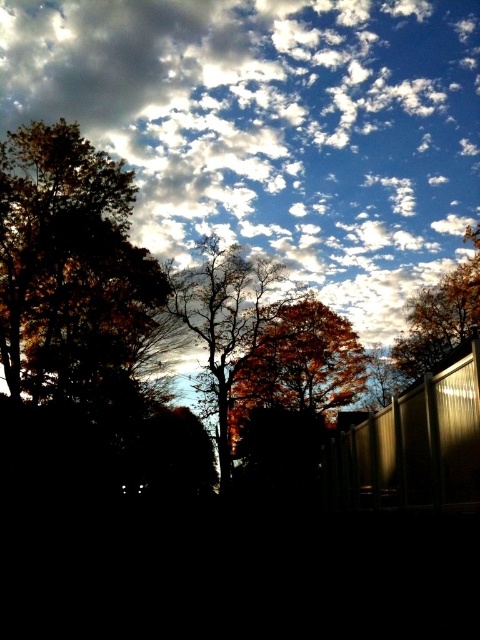
Looking at this image, which is more to the left, orange leafy tree at center or orange leafy tree at upper right?

orange leafy tree at center is more to the left.

Who is more forward, (263, 369) or (468, 260)?

Point (263, 369) is more forward.

This screenshot has height=640, width=480. In order to click on orange leafy tree at center in this screenshot , I will do `click(299, 365)`.

Can you confirm if golden-brown foliage at left is positioned above metallic corrugated fence at lower right?

Yes, golden-brown foliage at left is above metallic corrugated fence at lower right.

Between point (12, 250) and point (434, 499), which one is positioned in front?

Point (434, 499) is in front.

You are a GUI agent. You are given a task and a screenshot of the screen. Output one action in this format:
    pyautogui.click(x=<x>, y=<y>)
    Task: Click on the golden-brown foliage at left
    The height and width of the screenshot is (640, 480).
    Given the screenshot: What is the action you would take?
    pyautogui.click(x=69, y=262)

Who is taller, metallic corrugated fence at lower right or orange leafy tree at center?

With more height is orange leafy tree at center.

Is metallic corrugated fence at lower right to the left of orange leafy tree at center from the viewer's perspective?

Correct, you'll find metallic corrugated fence at lower right to the left of orange leafy tree at center.

Between point (432, 458) and point (241, 374), which one is positioned behind?

The point (241, 374) is behind.

I want to click on metallic corrugated fence at lower right, so click(411, 448).